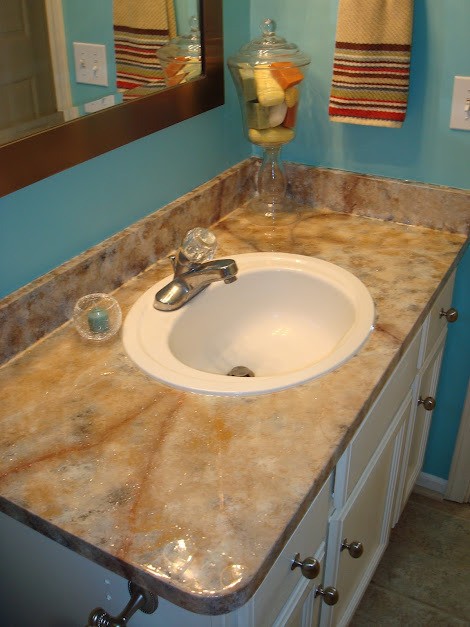
The height and width of the screenshot is (627, 470). I want to click on candle holder, so click(x=107, y=324).